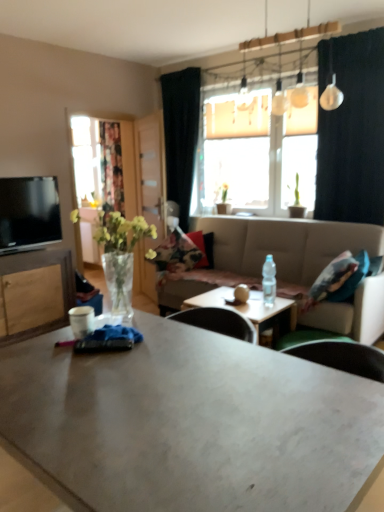
The image size is (384, 512). Describe the element at coordinates (191, 423) in the screenshot. I see `matte gray coffee table at center, which appears as the second coffee table when viewed from the back` at that location.

Describe the element at coordinates (269, 281) in the screenshot. The image size is (384, 512). I see `clear plastic bottle at center` at that location.

Identify the location of clear plastic bottle at center. click(x=269, y=281).

Where is `translucent fabric window at center`? translucent fabric window at center is located at coordinates (256, 153).

This screenshot has width=384, height=512. In order to click on matte white coffee table at center, which appears as the second coffee table when viewed from the front in this screenshot , I will do `click(251, 309)`.

You are a GUI agent. You are given a task and a screenshot of the screen. Output one action in this format:
    pyautogui.click(x=<x>, y=<y>)
    Task: Click on the matte gray coffee table at center, the 1th coffee table in the front-to-back sequence
    Image resolution: width=384 pixels, height=512 pixels.
    Given the screenshot: What is the action you would take?
    pyautogui.click(x=191, y=423)

From the image's perspective, which is above, black fabric curtain at upper center, the 2th curtain when ordered from right to left, or beige fabric couch at center?

From the image's view, black fabric curtain at upper center, the 2th curtain when ordered from right to left, is above.

Is black fabric curtain at upper center, placed as the second curtain when sorted from front to back, shorter than beige fabric couch at center?

In fact, black fabric curtain at upper center, placed as the second curtain when sorted from front to back, may be taller than beige fabric couch at center.

Visually, is black fabric curtain at upper center, placed as the second curtain when sorted from front to back, positioned to the left or to the right of beige fabric couch at center?

In the image, black fabric curtain at upper center, placed as the second curtain when sorted from front to back, appears on the left side of beige fabric couch at center.

Looking at this image, between black fabric curtain at upper center, which is counted as the first curtain, starting from the back, and beige fabric couch at center, which one has larger size?

Bigger between the two is beige fabric couch at center.

Is there a large distance between floral-patterned fabric pillow at center and beige fabric couch at center?

That's not correct — floral-patterned fabric pillow at center is a little close to beige fabric couch at center.

From the image's perspective, is floral-patterned fabric pillow at center above or below beige fabric couch at center?

floral-patterned fabric pillow at center is above beige fabric couch at center.

How different are the orientations of floral-patterned fabric pillow at center and beige fabric couch at center in degrees?

They differ by 28.3 degrees in their facing directions.

In terms of width, does floral-patterned fabric pillow at center look wider or thinner when compared to beige fabric couch at center?

floral-patterned fabric pillow at center is thinner than beige fabric couch at center.

Would you say beige fabric couch at center is inside or outside green matte plant at upper center?

beige fabric couch at center cannot be found inside green matte plant at upper center.

Can you confirm if beige fabric couch at center is positioned to the right of green matte plant at upper center?

Yes, beige fabric couch at center is to the right of green matte plant at upper center.

Is beige fabric couch at center facing away from green matte plant at upper center?

beige fabric couch at center is not turned away from green matte plant at upper center.

From the image's perspective, which one is positioned lower, beige fabric couch at center or green matte plant at upper center?

beige fabric couch at center is shown below in the image.

Between matte white coffee table at center, the 1th coffee table from the back, and floral fabric curtain at left, which one has larger size?

Bigger between the two is floral fabric curtain at left.

Who is more distant, matte white coffee table at center, the 1th coffee table from the back, or floral fabric curtain at left?

floral fabric curtain at left is further away from the camera.

From the image's perspective, relative to floral fabric curtain at left, is matte white coffee table at center, which appears as the second coffee table when viewed from the front, above or below?

matte white coffee table at center, which appears as the second coffee table when viewed from the front, is situated lower than floral fabric curtain at left in the image.

Measure the distance from matte white coffee table at center, which appears as the second coffee table when viewed from the front, to floral fabric curtain at left.

They are 7.13 feet apart.

From a real-world perspective, is matte white coffee table at center, which appears as the second coffee table when viewed from the front, under transparent glass door at center?

Yes.

Considering the positions of objects matte white coffee table at center, the 1th coffee table from the back, and transparent glass door at center in the image provided, who is more to the right, matte white coffee table at center, the 1th coffee table from the back, or transparent glass door at center?

matte white coffee table at center, the 1th coffee table from the back.

Is matte white coffee table at center, which appears as the second coffee table when viewed from the front, positioned beyond the bounds of transparent glass door at center?

Yes.

Is matte white coffee table at center, which appears as the second coffee table when viewed from the front, facing away from transparent glass door at center?

No, matte white coffee table at center, which appears as the second coffee table when viewed from the front,'s orientation is not away from transparent glass door at center.

Which of these two, matte black tv at left or clear plastic bottle at center, stands taller?

matte black tv at left.

From a real-world perspective, which is physically below, matte black tv at left or clear plastic bottle at center?

In real-world perspective, clear plastic bottle at center is lower.

Looking at this image, can you tell me how much matte black tv at left and clear plastic bottle at center differ in facing direction?

The angle between the facing direction of matte black tv at left and the facing direction of clear plastic bottle at center is 89.3 degrees.

Does beige fabric couch at center turn towards clear glass vase at left?

Yes, beige fabric couch at center is oriented towards clear glass vase at left.

Which is more to the left, beige fabric couch at center or clear glass vase at left?

clear glass vase at left.

Is point (248, 273) farther from viewer compared to point (124, 236)?

Yes, point (248, 273) is farther from viewer.

Locate an element on the screen. This screenshot has width=384, height=512. studio couch below the black fabric curtain at upper center, which is counted as the first curtain, starting from the back (from the image's perspective) is located at coordinates point(283,246).

Locate an element on the screen. The image size is (384, 512). studio couch beneath the floral-patterned fabric pillow at center (from a real-world perspective) is located at coordinates (283, 246).

Which object lies nearer to the anchor point black fabric curtain at upper center, placed as the second curtain when sorted from front to back, floral-patterned fabric pillow at center or wooden cabinet at left?

floral-patterned fabric pillow at center lies closer to black fabric curtain at upper center, placed as the second curtain when sorted from front to back, than the other object.

Consider the image. Based on their spatial positions, is beige fabric couch at center or matte gray coffee table at center, which appears as the second coffee table when viewed from the back, further from matte white coffee table at center, the 1th coffee table from the back?

Based on the image, matte gray coffee table at center, which appears as the second coffee table when viewed from the back, appears to be further to matte white coffee table at center, the 1th coffee table from the back.

When comparing their distances from floral fabric curtain at left, does transparent glass door at center or black fabric curtain at upper center, placed as the second curtain when sorted from front to back, seem closer?

transparent glass door at center lies closer to floral fabric curtain at left than the other object.

Considering their positions, is matte black tv at left positioned closer to clear plastic bottle at center than black fabric curtain at upper right, arranged as the second curtain when viewed from the left?

black fabric curtain at upper right, arranged as the second curtain when viewed from the left.

Which object lies nearer to the anchor point matte black tv at left, clear plastic bottle at center or matte white coffee table at center, the 1th coffee table from the back?

Based on the image, matte white coffee table at center, the 1th coffee table from the back, appears to be nearer to matte black tv at left.

Based on their spatial positions, is beige fabric couch at center or black fabric curtain at upper center, placed as the second curtain when sorted from front to back, closer to clear glass vase at left?

Based on the image, beige fabric couch at center appears to be nearer to clear glass vase at left.

Considering their positions, is black fabric curtain at upper right, arranged as the second curtain when viewed from the left, positioned closer to wooden cabinet at left than floral-patterned fabric pillow at center?

The object closer to wooden cabinet at left is floral-patterned fabric pillow at center.

Looking at the image, which one is located closer to matte gray coffee table at center, the 1th coffee table in the front-to-back sequence, green matte plant at upper center or transparent glass door at center?

transparent glass door at center is closer to matte gray coffee table at center, the 1th coffee table in the front-to-back sequence.

Locate an element on the screen. The image size is (384, 512). studio couch between matte gray coffee table at center, which appears as the second coffee table when viewed from the back, and black fabric curtain at upper center, which is counted as the first curtain, starting from the back, from front to back is located at coordinates (283, 246).

This screenshot has height=512, width=384. Find the location of `glass door between wooden cabinet at left and matte white coffee table at center, the 1th coffee table from the back, from left to right`. glass door between wooden cabinet at left and matte white coffee table at center, the 1th coffee table from the back, from left to right is located at coordinates (150, 174).

Find the location of a particular element. The width and height of the screenshot is (384, 512). pillow located between transparent glass door at center and translucent fabric window at center in the left-right direction is located at coordinates (178, 252).

The width and height of the screenshot is (384, 512). I want to click on bottle between black fabric curtain at upper right, which is counted as the 1th curtain, starting from the right, and beige fabric couch at center, in the vertical direction, so click(269, 281).